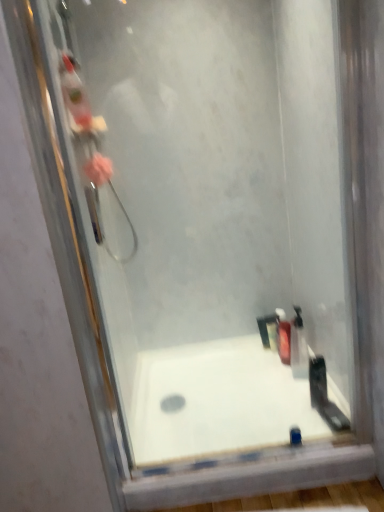
Find the location of a particular element. This screenshot has height=512, width=384. vacant space positioned to the left of black plastic razor at right, the third toiletry when ordered from back to front is located at coordinates (278, 403).